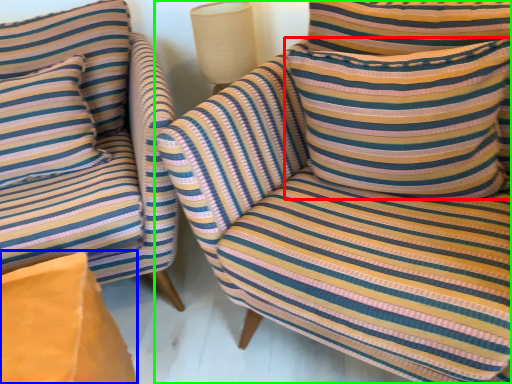
Question: Based on their relative distances, which object is nearer to pillow (highlighted by a red box)? Choose from cardboard box (highlighted by a blue box) and chair (highlighted by a green box).

Choices:
 (A) cardboard box
 (B) chair

Answer: (B)